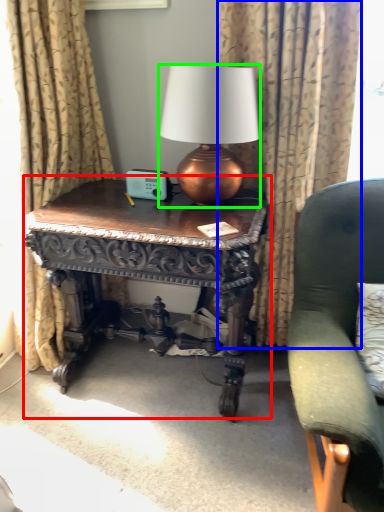
Question: Which is farther away from table (highlighted by a red box)? curtain (highlighted by a blue box) or lamp (highlighted by a green box)?

Choices:
 (A) curtain
 (B) lamp

Answer: (A)